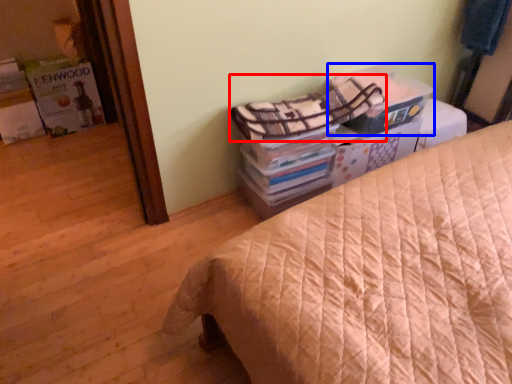
Question: Which object is further to the camera taking this photo, blanket (highlighted by a red box) or cardboard box (highlighted by a blue box)?

Choices:
 (A) blanket
 (B) cardboard box

Answer: (B)